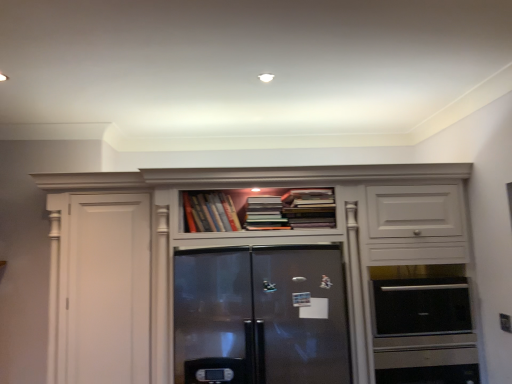
Question: Can you confirm if hardcover books at center, the third book when ordered from right to left, is bigger than hardcover books at upper center, the first book positioned from the right?

Choices:
 (A) no
 (B) yes

Answer: (A)

Question: Could you tell me if hardcover books at center, acting as the first book starting from the left, is turned towards hardcover books at upper center, the first book positioned from the right?

Choices:
 (A) no
 (B) yes

Answer: (A)

Question: Is hardcover books at center, acting as the first book starting from the left, shorter than hardcover books at upper center, the first book positioned from the right?

Choices:
 (A) yes
 (B) no

Answer: (B)

Question: Are hardcover books at center, acting as the first book starting from the left, and hardcover books at upper center, marked as the 3th book in a left-to-right arrangement, beside each other?

Choices:
 (A) no
 (B) yes

Answer: (A)

Question: Would you consider hardcover books at center, acting as the first book starting from the left, to be distant from hardcover books at upper center, the first book positioned from the right?

Choices:
 (A) no
 (B) yes

Answer: (A)

Question: From a real-world perspective, relative to satin black oven at right, is hardcover books at center, arranged as the 2th book when viewed from the left, vertically above or below?

Choices:
 (A) below
 (B) above

Answer: (B)

Question: Visually, is hardcover books at center, arranged as the second book when viewed from the right, positioned to the left or to the right of satin black oven at right?

Choices:
 (A) left
 (B) right

Answer: (A)

Question: In terms of width, does hardcover books at center, arranged as the 2th book when viewed from the left, look wider or thinner when compared to satin black oven at right?

Choices:
 (A) thin
 (B) wide

Answer: (B)

Question: Is hardcover books at center, arranged as the 2th book when viewed from the left, taller or shorter than satin black oven at right?

Choices:
 (A) short
 (B) tall

Answer: (A)

Question: In terms of width, does hardcover books at center, acting as the first book starting from the left, look wider or thinner when compared to matte white cabinet at center?

Choices:
 (A) thin
 (B) wide

Answer: (A)

Question: From the image's perspective, is hardcover books at center, acting as the first book starting from the left, positioned above or below matte white cabinet at center?

Choices:
 (A) above
 (B) below

Answer: (A)

Question: Relative to matte white cabinet at center, is hardcover books at center, the third book when ordered from right to left, in front or behind?

Choices:
 (A) front
 (B) behind

Answer: (B)

Question: Do you think hardcover books at center, the third book when ordered from right to left, is within matte white cabinet at center, or outside of it?

Choices:
 (A) inside
 (B) outside

Answer: (A)

Question: Considering the positions of satin stainless steel refrigerator at center and hardcover books at upper center, the first book positioned from the right, in the image, is satin stainless steel refrigerator at center taller or shorter than hardcover books at upper center, the first book positioned from the right,?

Choices:
 (A) short
 (B) tall

Answer: (B)

Question: Considering the positions of satin stainless steel refrigerator at center and hardcover books at upper center, marked as the 3th book in a left-to-right arrangement, in the image, is satin stainless steel refrigerator at center wider or thinner than hardcover books at upper center, marked as the 3th book in a left-to-right arrangement,?

Choices:
 (A) thin
 (B) wide

Answer: (B)